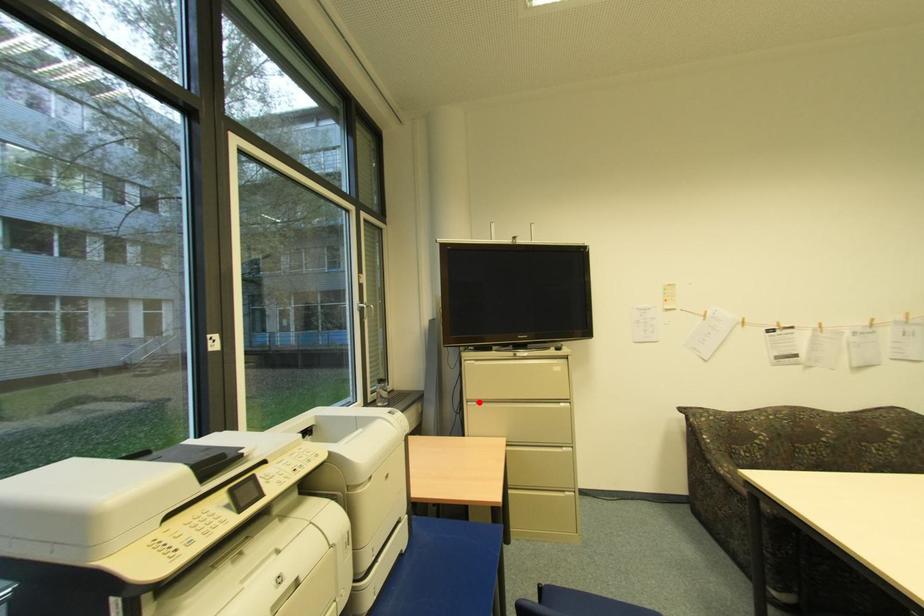
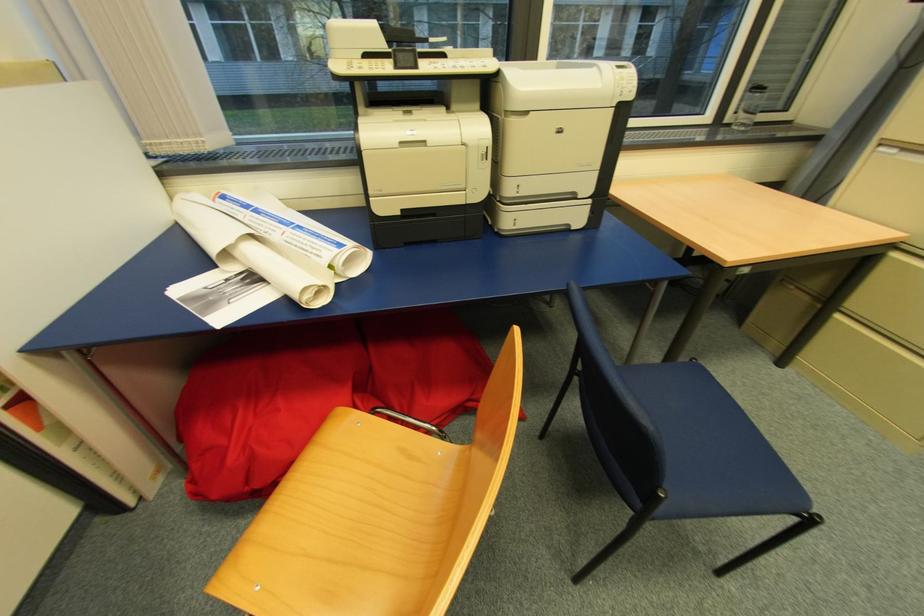
The point at the highlighted location is marked in the first image. Where is the corresponding point in the second image?

(902, 150)